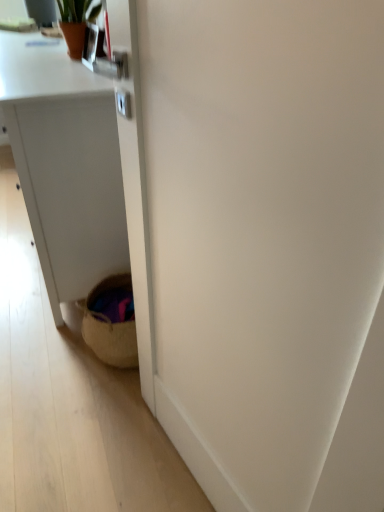
Question: Based on their positions, is white matte desk at lower left located to the left or right of terracotta pot at upper left?

Choices:
 (A) left
 (B) right

Answer: (A)

Question: From a real-world perspective, relative to terracotta pot at upper left, is white matte desk at lower left vertically above or below?

Choices:
 (A) above
 (B) below

Answer: (B)

Question: Considering the real-world distances, which object is closest to the woven basket at lower left?

Choices:
 (A) white matte desk at lower left
 (B) terracotta pot at upper left

Answer: (A)

Question: Which is farther from the woven basket at lower left?

Choices:
 (A) terracotta pot at upper left
 (B) white matte desk at lower left

Answer: (A)